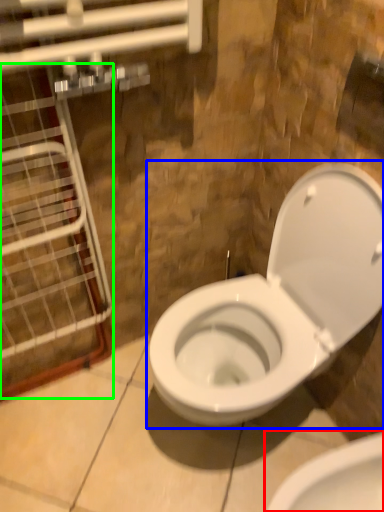
Question: Considering the real-world distances, which object is farthest from toilet (highlighted by a red box)? toilet (highlighted by a blue box) or glass door (highlighted by a green box)?

Choices:
 (A) toilet
 (B) glass door

Answer: (B)